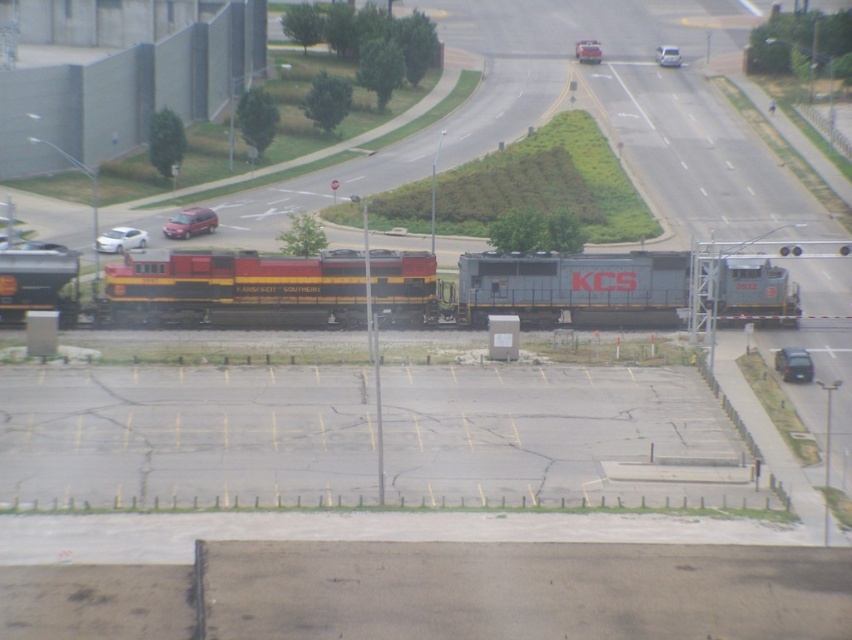
The height and width of the screenshot is (640, 852). Find the location of `metallic gray train at center`. metallic gray train at center is located at coordinates (239, 285).

Is metallic gray train at center wider than metallic gray sedan at center?

Yes.

Between point (551, 273) and point (797, 356), which one is positioned behind?

The point (551, 273) is behind.

You are a GUI agent. You are given a task and a screenshot of the screen. Output one action in this format:
    pyautogui.click(x=<x>, y=<y>)
    Task: Click on the metallic gray train at center
    
    Given the screenshot: What is the action you would take?
    pyautogui.click(x=239, y=285)

Who is positioned more to the left, metallic gray sedan at center or white glossy sedan at left?

From the viewer's perspective, white glossy sedan at left appears more on the left side.

Can you confirm if metallic gray sedan at center is smaller than white glossy sedan at left?

Correct, metallic gray sedan at center occupies less space than white glossy sedan at left.

Is point (787, 355) behind point (4, 246)?

No, (787, 355) is closer to viewer.

The height and width of the screenshot is (640, 852). I want to click on metallic gray sedan at center, so click(793, 364).

Which is more to the left, white glossy sedan at lower left or white glossy sedan at center?

Positioned to the left is white glossy sedan at lower left.

Is white glossy sedan at lower left wider than white glossy sedan at center?

No.

Is point (124, 241) farther from viewer compared to point (671, 45)?

No, it is in front of (671, 45).

The image size is (852, 640). What are the coordinates of `white glossy sedan at lower left` in the screenshot? It's located at (121, 240).